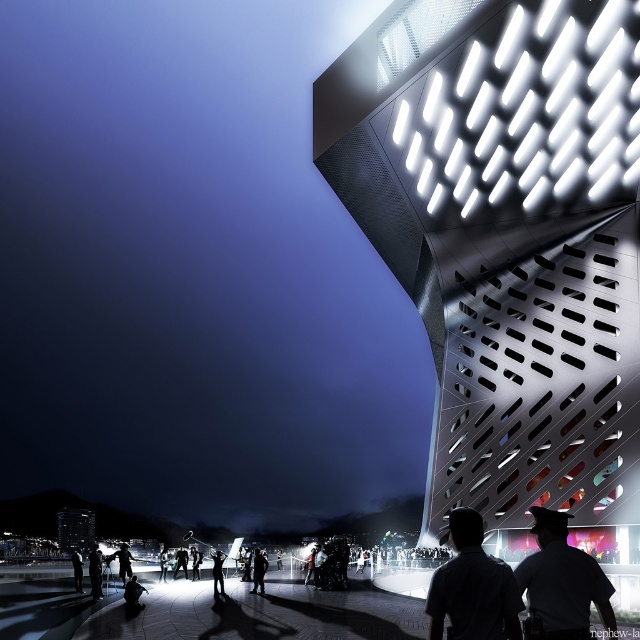
Question: Is metallic perforated facade at upper right further to camera compared to dark gray fabric shirt at center?

Choices:
 (A) yes
 (B) no

Answer: (A)

Question: Is dark gray fabric shirt at center further to the viewer compared to dark gray fabric jacket at lower left?

Choices:
 (A) no
 (B) yes

Answer: (A)

Question: Does silhouette uniformed officer at center appear on the left side of dark gray fabric jacket at lower left?

Choices:
 (A) yes
 (B) no

Answer: (B)

Question: Which point is farther to the camera?

Choices:
 (A) (458, 180)
 (B) (465, 605)
 (C) (525, 564)
 (D) (99, 570)

Answer: (A)

Question: Among these points, which one is nearest to the camera?

Choices:
 (A) (438, 570)
 (B) (97, 573)
 (C) (547, 513)

Answer: (A)

Question: Which of the following is the closest to the observer?

Choices:
 (A) dark gray fabric jacket at lower left
 (B) metallic perforated facade at upper right
 (C) silhouette uniformed officer at center

Answer: (C)